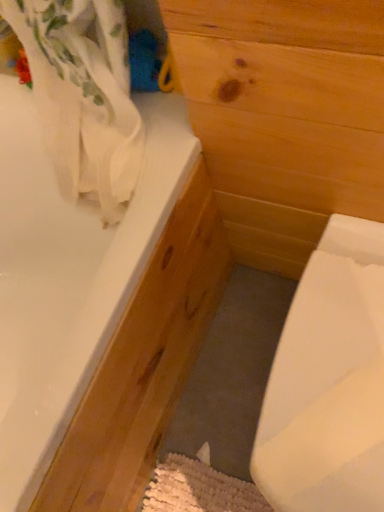
Question: Considering the relative positions of white glossy sink at lower right and white glossy bathtub at upper left in the image provided, is white glossy sink at lower right to the left or to the right of white glossy bathtub at upper left?

Choices:
 (A) left
 (B) right

Answer: (B)

Question: From the image's perspective, is white glossy sink at lower right positioned above or below white glossy bathtub at upper left?

Choices:
 (A) above
 (B) below

Answer: (B)

Question: Is point (324, 350) closer or farther from the camera than point (127, 323)?

Choices:
 (A) closer
 (B) farther

Answer: (A)

Question: From a real-world perspective, is white glossy bathtub at upper left above or below white glossy sink at lower right?

Choices:
 (A) above
 (B) below

Answer: (A)

Question: In terms of height, does white glossy bathtub at upper left look taller or shorter compared to white glossy sink at lower right?

Choices:
 (A) tall
 (B) short

Answer: (A)

Question: From the image's perspective, is white glossy bathtub at upper left above or below white glossy sink at lower right?

Choices:
 (A) above
 (B) below

Answer: (A)

Question: Looking at their shapes, would you say white glossy bathtub at upper left is wider or thinner than white glossy sink at lower right?

Choices:
 (A) thin
 (B) wide

Answer: (B)